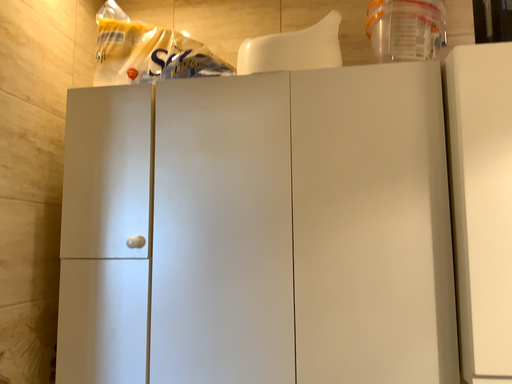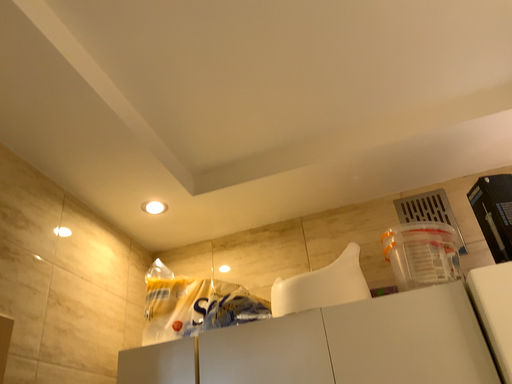
Question: Which way did the camera rotate in the video?

Choices:
 (A) rotated upward
 (B) rotated downward

Answer: (A)